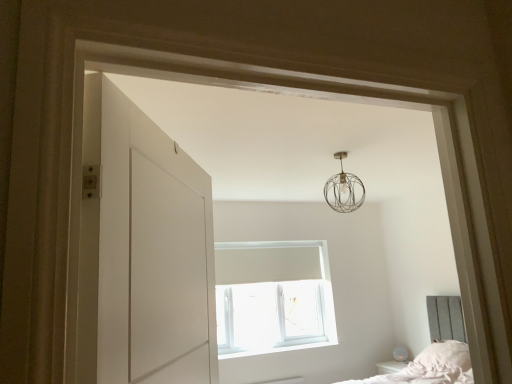
Question: From the image's perspective, is white plastic window at center beneath white painted wood at lower center?

Choices:
 (A) yes
 (B) no

Answer: (B)

Question: Can you confirm if white plastic window at center is shorter than white painted wood at lower center?

Choices:
 (A) yes
 (B) no

Answer: (B)

Question: Considering the relative sizes of white plastic window at center and white painted wood at lower center in the image provided, is white plastic window at center taller than white painted wood at lower center?

Choices:
 (A) yes
 (B) no

Answer: (A)

Question: From a real-world perspective, is white plastic window at center under white painted wood at lower center?

Choices:
 (A) yes
 (B) no

Answer: (B)

Question: Considering the relative sizes of white plastic window at center and white painted wood at lower center in the image provided, is white plastic window at center thinner than white painted wood at lower center?

Choices:
 (A) yes
 (B) no

Answer: (A)

Question: Is white plastic window at center located outside white painted wood at lower center?

Choices:
 (A) no
 (B) yes

Answer: (B)

Question: Is white painted wood at lower center directly adjacent to white plastic window at center?

Choices:
 (A) yes
 (B) no

Answer: (B)

Question: Is white plastic window at center completely or partially inside white painted wood at lower center?

Choices:
 (A) yes
 (B) no

Answer: (B)

Question: From the image's perspective, is white painted wood at lower center located above white plastic window at center?

Choices:
 (A) no
 (B) yes

Answer: (A)

Question: Considering the relative positions of white painted wood at lower center and white plastic window at center in the image provided, is white painted wood at lower center to the left of white plastic window at center from the viewer's perspective?

Choices:
 (A) no
 (B) yes

Answer: (A)

Question: From the image's perspective, is white painted wood at lower center located beneath white plastic window at center?

Choices:
 (A) no
 (B) yes

Answer: (B)

Question: Is white painted wood at lower center thinner than white plastic window at center?

Choices:
 (A) no
 (B) yes

Answer: (A)

Question: Is white painted wood at lower center positioned beyond the bounds of metallic wire sphere at upper center?

Choices:
 (A) no
 (B) yes

Answer: (B)